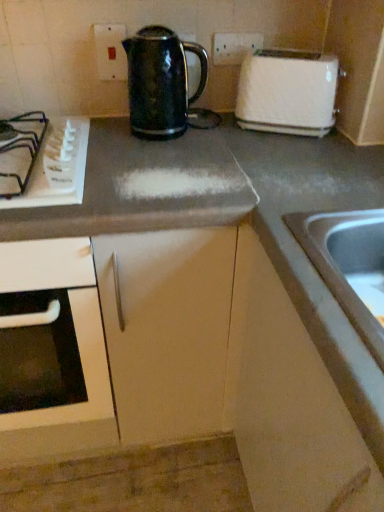
Question: Is matte gray cabinet at lower right, positioned as the 1th cabinetry in right-to-left order, at the left side of stainless steel sink at lower right?

Choices:
 (A) no
 (B) yes

Answer: (A)

Question: Does matte gray cabinet at lower right, which is the 2th cabinetry in left-to-right order, turn towards stainless steel sink at lower right?

Choices:
 (A) yes
 (B) no

Answer: (A)

Question: Is stainless steel sink at lower right inside matte gray cabinet at lower right, positioned as the 1th cabinetry in right-to-left order?

Choices:
 (A) yes
 (B) no

Answer: (A)

Question: Is matte gray cabinet at lower right, positioned as the 1th cabinetry in right-to-left order, behind stainless steel sink at lower right?

Choices:
 (A) no
 (B) yes

Answer: (A)

Question: Can you confirm if matte gray cabinet at lower right, which is the 2th cabinetry in left-to-right order, is shorter than stainless steel sink at lower right?

Choices:
 (A) yes
 (B) no

Answer: (B)

Question: From the image's perspective, is matte gray cabinet at lower right, which is the 2th cabinetry in left-to-right order, below stainless steel sink at lower right?

Choices:
 (A) yes
 (B) no

Answer: (A)

Question: Is the position of white plastic gas stove at left less distant than that of white plastic toaster at upper right?

Choices:
 (A) yes
 (B) no

Answer: (A)

Question: From the image's perspective, would you say white plastic gas stove at left is positioned over white plastic toaster at upper right?

Choices:
 (A) no
 (B) yes

Answer: (A)

Question: Is white plastic gas stove at left to the left of white plastic toaster at upper right from the viewer's perspective?

Choices:
 (A) no
 (B) yes

Answer: (B)

Question: Is white plastic gas stove at left thinner than white plastic toaster at upper right?

Choices:
 (A) yes
 (B) no

Answer: (B)

Question: Does white plastic gas stove at left appear on the right side of white plastic toaster at upper right?

Choices:
 (A) no
 (B) yes

Answer: (A)

Question: Can we say white plastic gas stove at left lies outside white plastic toaster at upper right?

Choices:
 (A) no
 (B) yes

Answer: (B)

Question: From a real-world perspective, is shiny black kettle at center positioned over matte white electric outlet at upper center based on gravity?

Choices:
 (A) yes
 (B) no

Answer: (B)